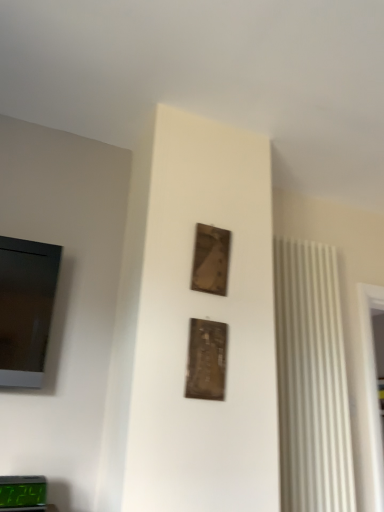
Question: Is the position of green digital display at lower left less distant than that of metallic gold picture frame at center, arranged as the second picture frame when viewed from the back?

Choices:
 (A) no
 (B) yes

Answer: (B)

Question: From the image's perspective, does green digital display at lower left appear higher than metallic gold picture frame at center, placed as the second picture frame when sorted from top to bottom?

Choices:
 (A) no
 (B) yes

Answer: (A)

Question: Could you tell me if green digital display at lower left is facing metallic gold picture frame at center, the 1th picture frame positioned from the front?

Choices:
 (A) yes
 (B) no

Answer: (B)

Question: Can you confirm if green digital display at lower left is bigger than metallic gold picture frame at center, placed as the second picture frame when sorted from top to bottom?

Choices:
 (A) yes
 (B) no

Answer: (A)

Question: From a real-world perspective, does green digital display at lower left sit lower than metallic gold picture frame at center, placed as the second picture frame when sorted from top to bottom?

Choices:
 (A) no
 (B) yes

Answer: (B)

Question: Considering the positions of green digital display at lower left and wooden frame at upper center, which is the 1th picture frame in top-to-bottom order, in the image, is green digital display at lower left wider or thinner than wooden frame at upper center, which is the 1th picture frame in top-to-bottom order,?

Choices:
 (A) wide
 (B) thin

Answer: (A)

Question: Is green digital display at lower left inside the boundaries of wooden frame at upper center, the 2th picture frame positioned from the front, or outside?

Choices:
 (A) inside
 (B) outside

Answer: (B)

Question: From the image's perspective, is green digital display at lower left positioned above or below wooden frame at upper center, the 1th picture frame positioned from the back?

Choices:
 (A) above
 (B) below

Answer: (B)

Question: Does point (1, 498) appear closer or farther from the camera than point (208, 279)?

Choices:
 (A) closer
 (B) farther

Answer: (A)

Question: Choose the correct answer: Is green digital display at lower left inside metallic gold picture frame at center, arranged as the second picture frame when viewed from the back, or outside it?

Choices:
 (A) inside
 (B) outside

Answer: (B)

Question: Is green digital display at lower left bigger or smaller than metallic gold picture frame at center, the 1th picture frame positioned from the front?

Choices:
 (A) big
 (B) small

Answer: (A)

Question: Is point (23, 508) positioned closer to the camera than point (203, 343)?

Choices:
 (A) farther
 (B) closer

Answer: (B)

Question: Based on their positions, is green digital display at lower left located to the left or right of metallic gold picture frame at center, placed as the second picture frame when sorted from top to bottom?

Choices:
 (A) right
 (B) left

Answer: (B)

Question: From a real-world perspective, is wooden frame at upper center, the 2th picture frame positioned from the front, positioned above or below green digital display at lower left?

Choices:
 (A) below
 (B) above

Answer: (B)

Question: Does point (206, 289) appear closer or farther from the camera than point (14, 499)?

Choices:
 (A) farther
 (B) closer

Answer: (A)